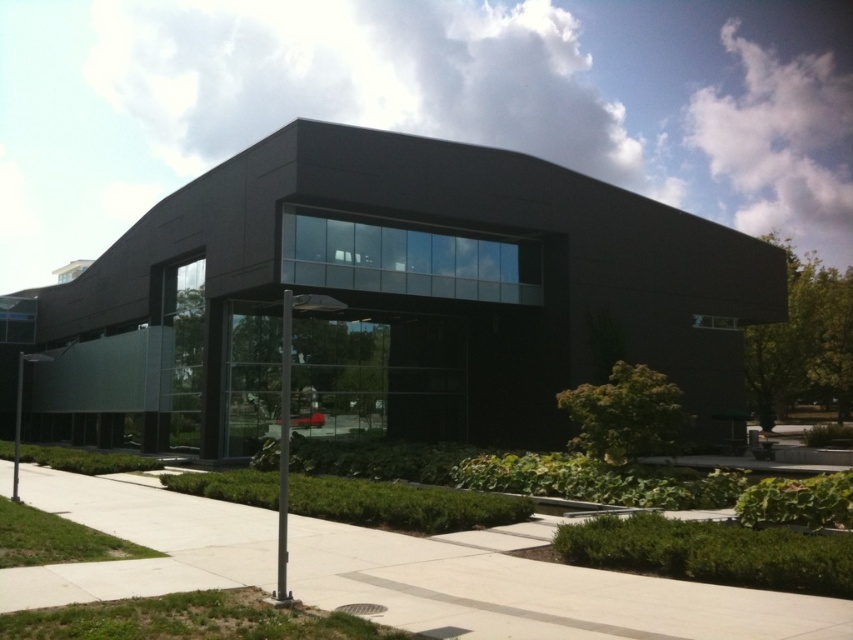
You are standing at the entrance of the modern building and want to locate both the black metallic pole at center and the metallic pole at lower left. Based on their positions, which pole is closer to the walkway?

The metallic pole at lower left is closer to the walkway because it is positioned lower than the black metallic pole at center, which is above it.

You are a delivery person trying to park your 1.5 meter wide delivery cart on the paved walkway. The walkway is bordered by the concrete at center and the metallic pole at lower left. Can you fit your cart between them?

The concrete at center occupies less space than metallic pole at lower left. Since the concrete at center is smaller, there might be enough space between them to fit the 1.5 meter wide cart, but it depends on the exact positioning. However, since the description only states the size comparison between the two objects, we cannot confirm the exact width of the path. Please check the actual space before parking.

You are standing on the walkway in front of the modern building and see the concrete at center and the black metallic pole at center. Which object is located lower in the scene?

The concrete at center is located below the black metallic pole at center, so the concrete at center is lower in the scene.